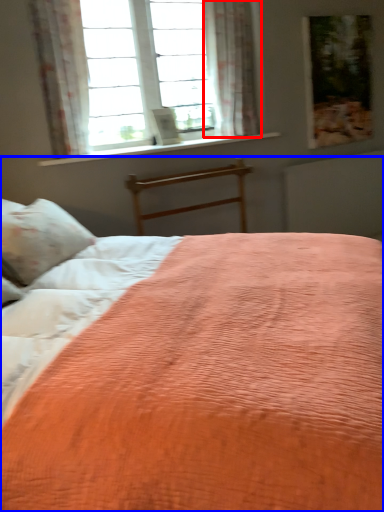
Question: Which object is further to the camera taking this photo, curtain (highlighted by a red box) or bed (highlighted by a blue box)?

Choices:
 (A) curtain
 (B) bed

Answer: (A)